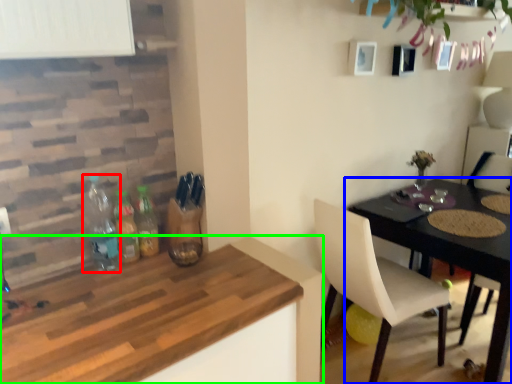
Question: Which object is positioned closest to bottle (highlighted by a red box)? Select from table (highlighted by a blue box) and kitchen & dining room table (highlighted by a green box).

Choices:
 (A) table
 (B) kitchen & dining room table

Answer: (B)